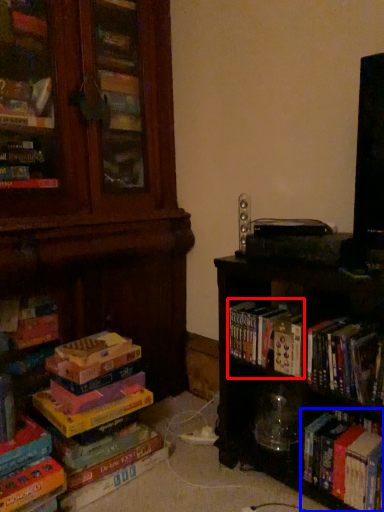
Question: Which object is closer to the camera taking this photo, book (highlighted by a red box) or book (highlighted by a blue box)?

Choices:
 (A) book
 (B) book

Answer: (B)